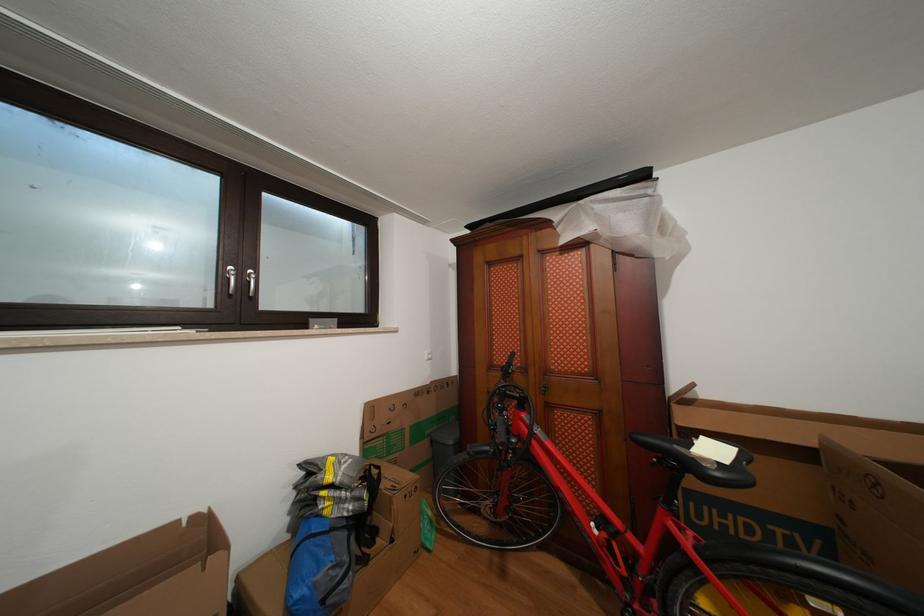
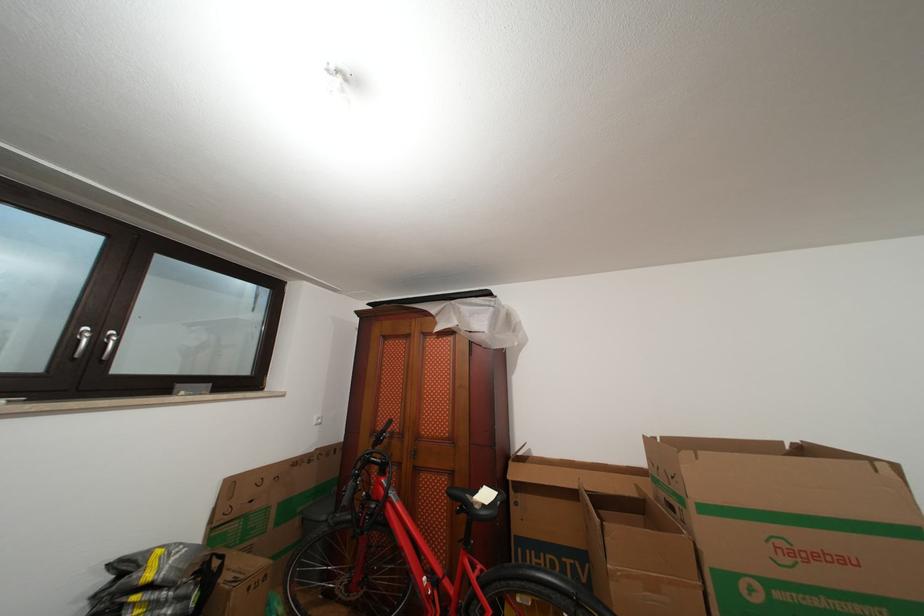
Question: The camera is either moving clockwise (left) or counter-clockwise (right) around the object. The first image is from the beginning of the video and the second image is from the end. Is the camera moving left or right when shooting the video?

Choices:
 (A) Left
 (B) Right

Answer: (A)